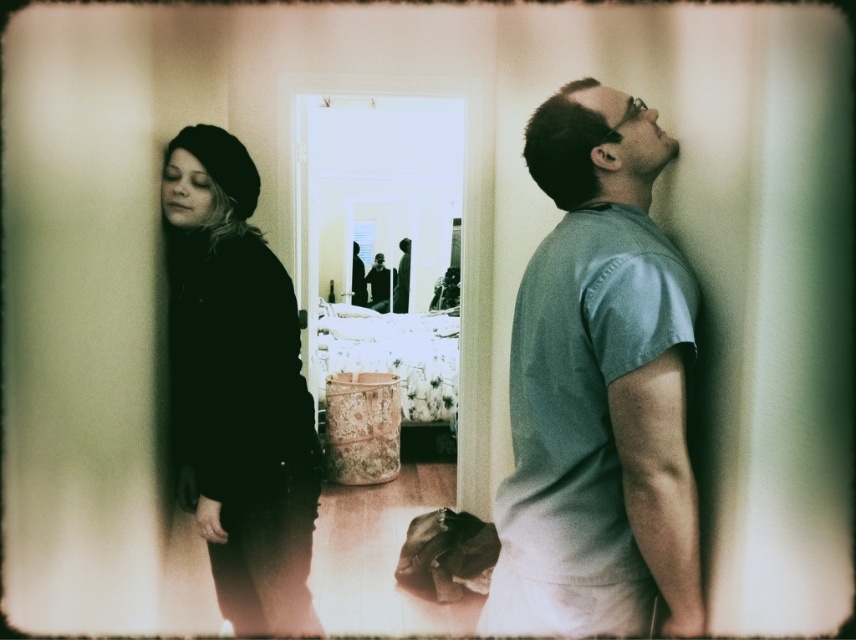
Question: Which point is farther to the camera?

Choices:
 (A) black matte beret at left
 (B) light blue t-shirt at right
 (C) dark matte jacket at left

Answer: (A)

Question: In this image, where is dark matte jacket at left located relative to light blue t-shirt at right?

Choices:
 (A) left
 (B) right

Answer: (B)

Question: From the image, what is the correct spatial relationship of light blue t-shirt at right in relation to black matte beret at left?

Choices:
 (A) below
 (B) above

Answer: (B)

Question: Which point is farther to the camera?

Choices:
 (A) (254, 310)
 (B) (174, 198)

Answer: (B)

Question: Among these points, which one is nearest to the camera?

Choices:
 (A) (657, 323)
 (B) (603, 88)

Answer: (A)

Question: Is dark matte jacket at left below black matte beret at left?

Choices:
 (A) no
 (B) yes

Answer: (A)